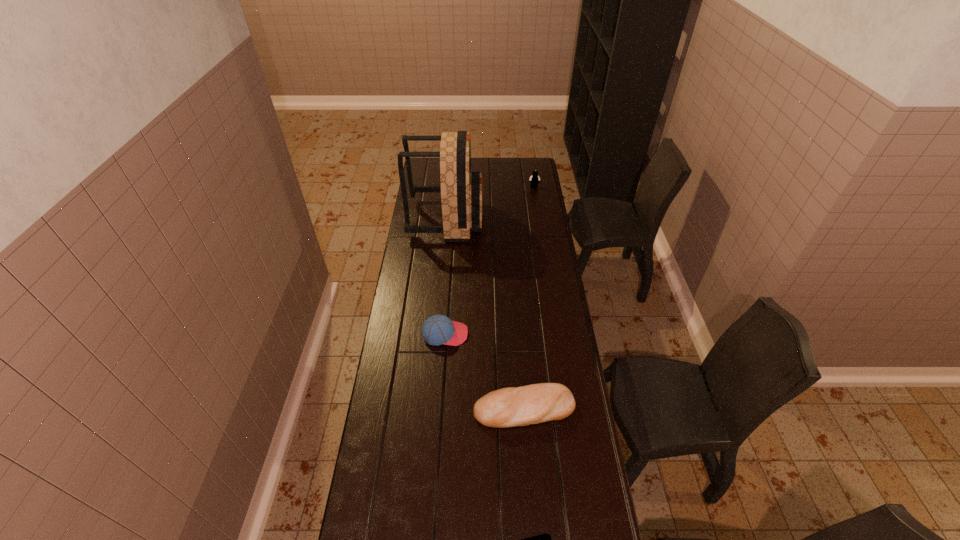
The width and height of the screenshot is (960, 540). Identify the location of free region that satisfies the following two spatial constraints: 1. on the front-facing side of the second tallest object; 2. on the front-facing side of the third farthest object. (557, 334).